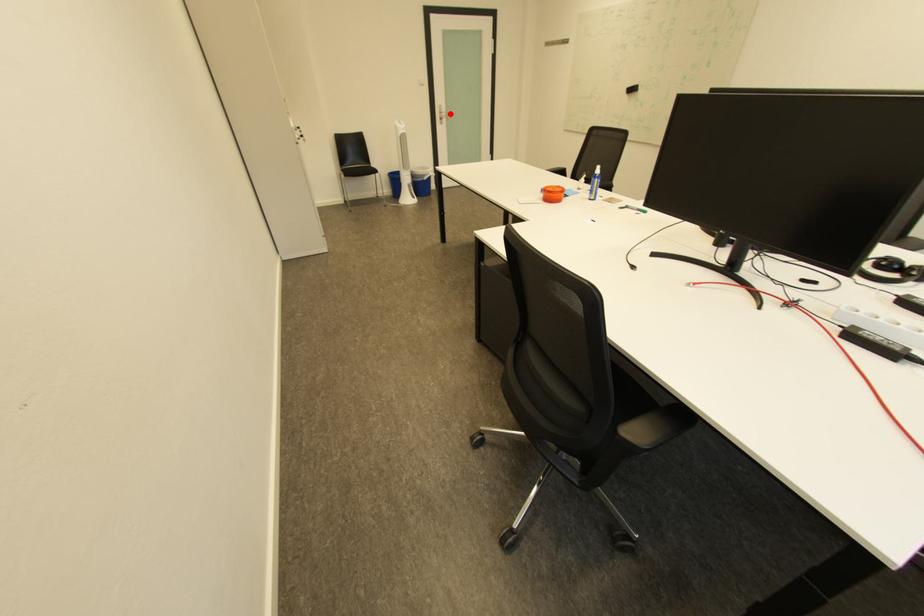
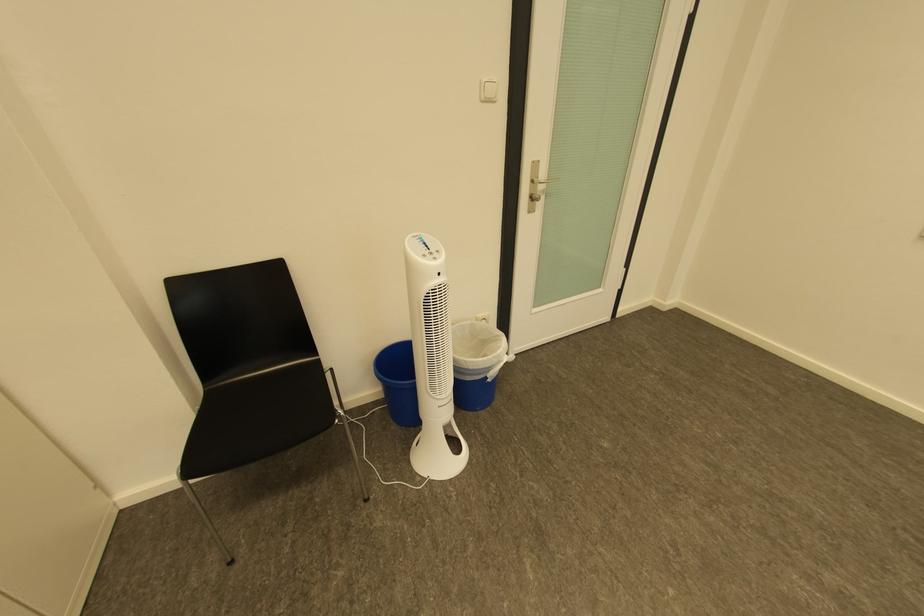
Question: I am providing you with two images of the same scene from different viewpoints. Given a red point in image1, look at the same physical point in image2. Is it:

Choices:
 (A) Closer to the viewpoint
 (B) Farther from the viewpoint

Answer: (B)